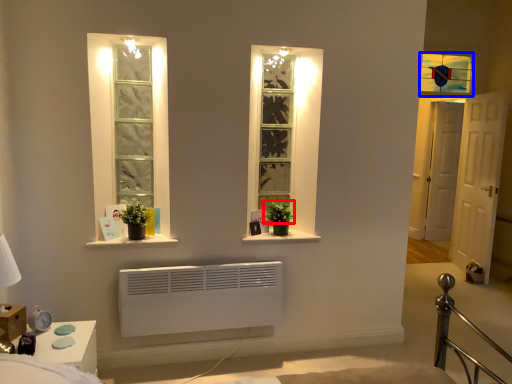
Question: Which object is closer to the camera taking this photo, plant (highlighted by a red box) or window (highlighted by a blue box)?

Choices:
 (A) plant
 (B) window

Answer: (A)